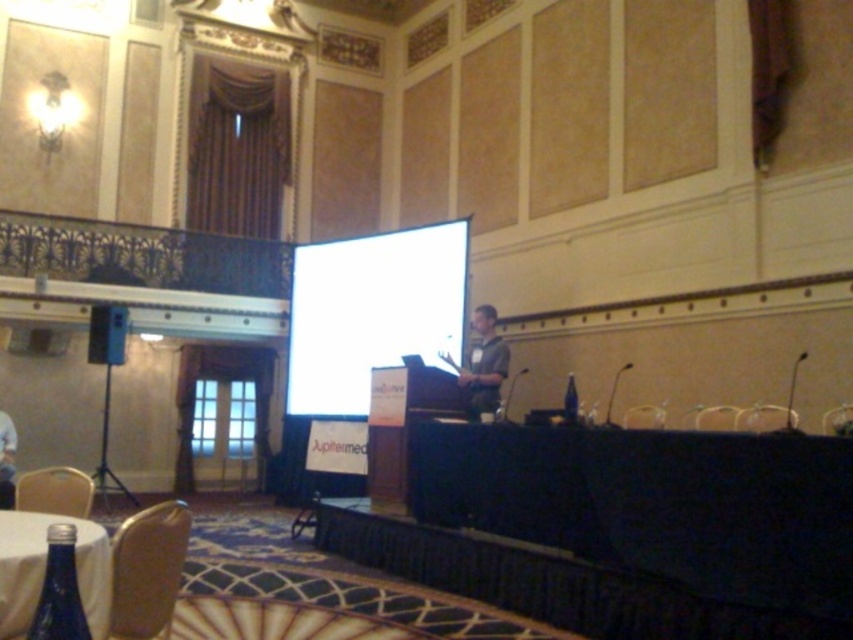
You are an event organizer who needs to seat VIP guests. You have two chairs available in the room. The metallic gold chair at lower left and the brown leather chair at lower right. Which chair should you choose if you want to seat a guest who requires a more spacious seating option?

The metallic gold chair at lower left is larger in size than the brown leather chair at lower right, so you should choose the metallic gold chair at lower left for the guest requiring more spacious seating.

You are attending a presentation in the conference room and need to choose a seat. You see a metallic gold chair at lower left and a brown leather chair at lower right. Which chair is positioned lower in the image?

The metallic gold chair at lower left is positioned lower in the image than the brown leather chair at lower right.